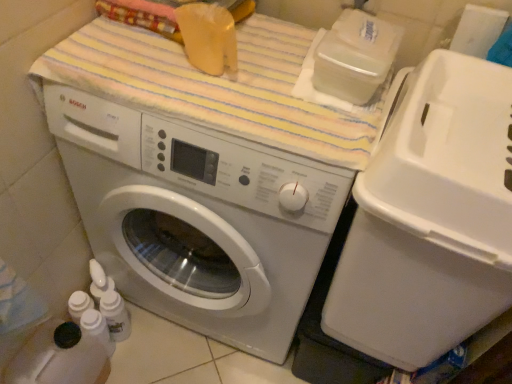
Question: Considering the relative sizes of white plastic water cooler at right and white glossy washing machine at center in the image provided, is white plastic water cooler at right wider than white glossy washing machine at center?

Choices:
 (A) yes
 (B) no

Answer: (B)

Question: Does white plastic water cooler at right appear on the right side of white glossy washing machine at center?

Choices:
 (A) no
 (B) yes

Answer: (B)

Question: Would you say white glossy washing machine at center is part of white plastic water cooler at right's contents?

Choices:
 (A) no
 (B) yes

Answer: (A)

Question: Considering the relative positions of white plastic water cooler at right and white glossy washing machine at center in the image provided, is white plastic water cooler at right to the left of white glossy washing machine at center from the viewer's perspective?

Choices:
 (A) yes
 (B) no

Answer: (B)

Question: Is white plastic water cooler at right outside of white glossy washing machine at center?

Choices:
 (A) yes
 (B) no

Answer: (A)

Question: Are white plastic water cooler at right and white glossy washing machine at center far apart?

Choices:
 (A) no
 (B) yes

Answer: (A)

Question: From a real-world perspective, is white glossy washing machine at center beneath white plastic water cooler at right?

Choices:
 (A) yes
 (B) no

Answer: (A)

Question: Is white glossy washing machine at center positioned before white plastic water cooler at right?

Choices:
 (A) no
 (B) yes

Answer: (A)

Question: Is white glossy washing machine at center thinner than white plastic water cooler at right?

Choices:
 (A) yes
 (B) no

Answer: (B)

Question: Is white glossy washing machine at center outside white plastic water cooler at right?

Choices:
 (A) yes
 (B) no

Answer: (A)

Question: Is white glossy washing machine at center facing away from white plastic water cooler at right?

Choices:
 (A) no
 (B) yes

Answer: (A)

Question: Is white glossy washing machine at center wider than white plastic water cooler at right?

Choices:
 (A) no
 (B) yes

Answer: (B)

Question: Is striped cotton bath towel at upper center completely or partially outside of white plastic water cooler at right?

Choices:
 (A) no
 (B) yes

Answer: (B)